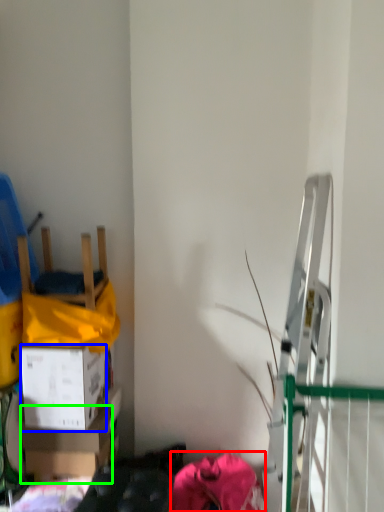
Question: Estimate the real-world distances between objects in this image. Which object is farther from clothing (highlighted by a red box), box (highlighted by a blue box) or box (highlighted by a green box)?

Choices:
 (A) box
 (B) box

Answer: (A)